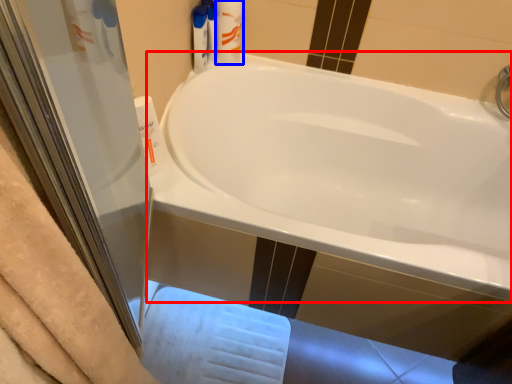
Question: Among these objects, which one is nearest to the camera, bathtub (highlighted by a red box) or toiletry (highlighted by a blue box)?

Choices:
 (A) bathtub
 (B) toiletry

Answer: (A)